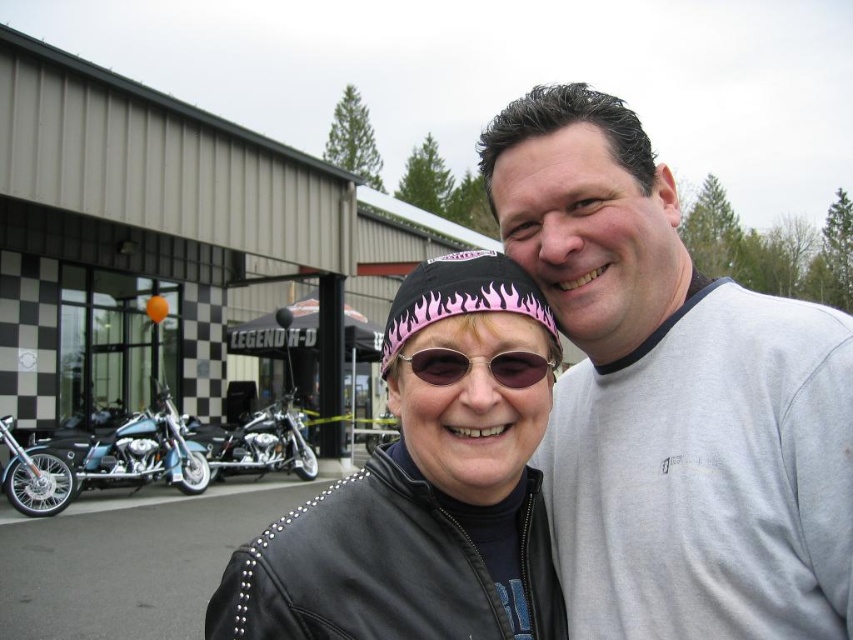
Consider the image. You are a photographer trying to capture the pink fabric headscarf at center in your shot. Given that the camera is focused on the point at coordinate [462,298], can you confirm if this point is where the pink fabric headscarf at center is located?

Yes, the point at coordinate [462,298] corresponds to the pink fabric headscarf at center, so the camera is focused on the correct location.